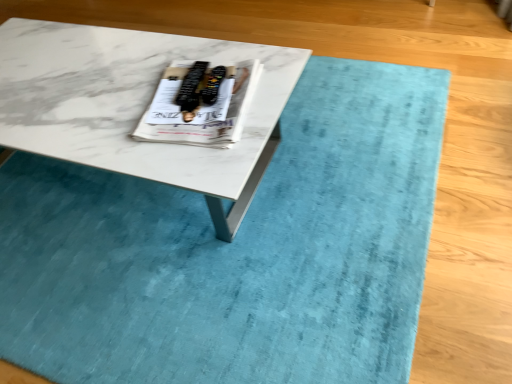
Question: From the image's perspective, is white marble coffee table at center positioned above or below white glossy magazine at center?

Choices:
 (A) below
 (B) above

Answer: (A)

Question: Is point (193, 165) positioned closer to the camera than point (162, 94)?

Choices:
 (A) closer
 (B) farther

Answer: (A)

Question: In the image, is white marble coffee table at center positioned in front of or behind white glossy magazine at center?

Choices:
 (A) front
 (B) behind

Answer: (A)

Question: Does point (216, 142) appear closer or farther from the camera than point (180, 162)?

Choices:
 (A) farther
 (B) closer

Answer: (A)

Question: Considering the positions of white glossy magazine at center and white marble coffee table at center in the image, is white glossy magazine at center wider or thinner than white marble coffee table at center?

Choices:
 (A) thin
 (B) wide

Answer: (A)

Question: Is white glossy magazine at center in front of or behind white marble coffee table at center in the image?

Choices:
 (A) behind
 (B) front

Answer: (A)

Question: From a real-world perspective, is white glossy magazine at center above or below white marble coffee table at center?

Choices:
 (A) below
 (B) above

Answer: (B)